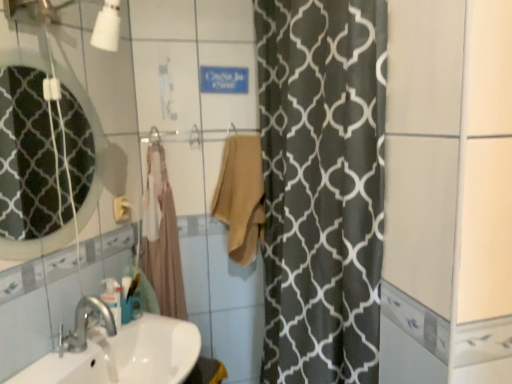
Question: Is matte glass mirror at upper left thinner than white glossy sink at lower left?

Choices:
 (A) yes
 (B) no

Answer: (A)

Question: Is matte glass mirror at upper left oriented towards white glossy sink at lower left?

Choices:
 (A) yes
 (B) no

Answer: (B)

Question: Is matte glass mirror at upper left bigger than white glossy sink at lower left?

Choices:
 (A) no
 (B) yes

Answer: (A)

Question: Is matte glass mirror at upper left positioned with its back to white glossy sink at lower left?

Choices:
 (A) no
 (B) yes

Answer: (A)

Question: Would you consider matte glass mirror at upper left to be distant from white glossy sink at lower left?

Choices:
 (A) yes
 (B) no

Answer: (B)

Question: In the image, is beige cotton towel at center, the second bath towel in the left-to-right sequence, on the left side or the right side of matte glass mirror at upper left?

Choices:
 (A) right
 (B) left

Answer: (A)

Question: Is point (233, 241) positioned closer to the camera than point (4, 74)?

Choices:
 (A) farther
 (B) closer

Answer: (B)

Question: Relative to matte glass mirror at upper left, is beige cotton towel at center, the second bath towel in the left-to-right sequence, in front or behind?

Choices:
 (A) behind
 (B) front

Answer: (A)

Question: Looking at the image, does beige cotton towel at center, the second bath towel in the left-to-right sequence, seem bigger or smaller compared to matte glass mirror at upper left?

Choices:
 (A) small
 (B) big

Answer: (B)

Question: Is beige cotton bath towel at center, acting as the first bath towel starting from the left, to the left or to the right of matte glass mirror at upper left in the image?

Choices:
 (A) left
 (B) right

Answer: (B)

Question: Considering the positions of beige cotton bath towel at center, marked as the 2th bath towel in a right-to-left arrangement, and matte glass mirror at upper left in the image, is beige cotton bath towel at center, marked as the 2th bath towel in a right-to-left arrangement, wider or thinner than matte glass mirror at upper left?

Choices:
 (A) thin
 (B) wide

Answer: (B)

Question: From the image's perspective, is beige cotton bath towel at center, acting as the first bath towel starting from the left, positioned above or below matte glass mirror at upper left?

Choices:
 (A) below
 (B) above

Answer: (A)

Question: In the image, is beige cotton bath towel at center, marked as the 2th bath towel in a right-to-left arrangement, positioned in front of or behind matte glass mirror at upper left?

Choices:
 (A) front
 (B) behind

Answer: (B)

Question: Is matte glass mirror at upper left inside the boundaries of white glossy sink at lower left, or outside?

Choices:
 (A) outside
 (B) inside

Answer: (A)

Question: Considering their positions, is matte glass mirror at upper left located in front of or behind white glossy sink at lower left?

Choices:
 (A) front
 (B) behind

Answer: (B)